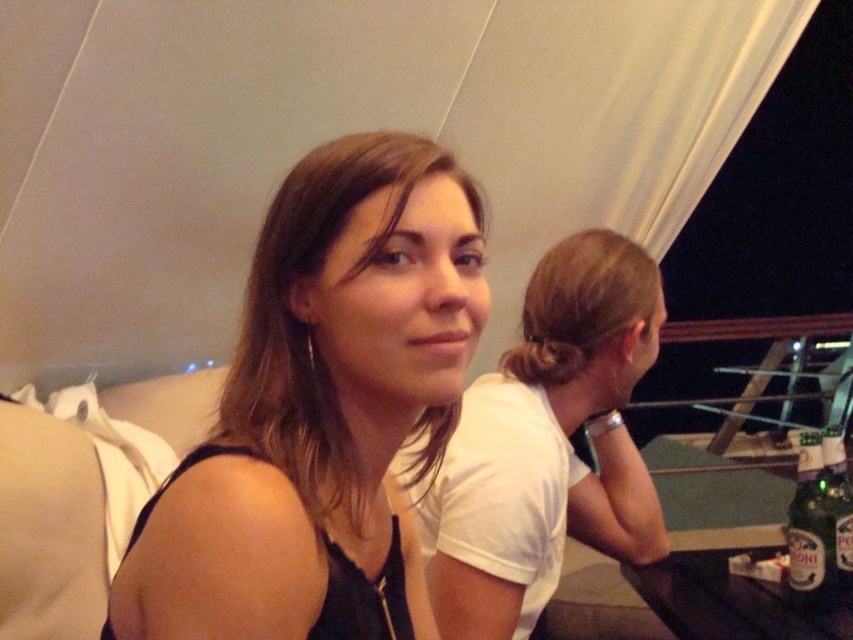
You are standing in the room and see two points marked in the image. Which point, point [247,403] or point [840,465], is closer to you?

Point [247,403] is closer to the viewer than point [840,465].

You are a photographer adjusting the camera focus. You need to ensure that both the matte black top at center and the green glass bottle at lower right are in focus. Given that the camera can only focus on objects of a certain size, which object should you prioritize focusing on first?

The matte black top at center is bigger than the green glass bottle at lower right, so you should prioritize focusing on the matte black top at center first because larger objects require more precise focus to ensure clarity.

You are a photographer standing at the camera position. You want to ensure that the matte black top at center is in focus while the background remains blurred. Given that the camera has a depth of field setting that can blur objects beyond 50 centimeters from the lens, will the background be sufficiently blurred?

The matte black top at center is 50.57 centimeters away from the camera. Since the depth of field setting blurs objects beyond 50 centimeters, the matte black top at center is just slightly beyond the threshold, so the background will be sufficiently blurred.